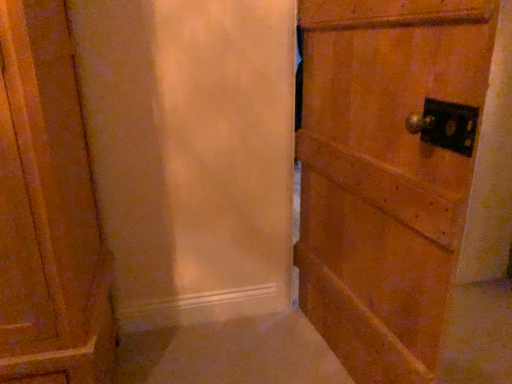
The height and width of the screenshot is (384, 512). What are the coordinates of `wooden door at center` in the screenshot? It's located at click(408, 187).

What do you see at coordinates (408, 187) in the screenshot? I see `wooden door at center` at bounding box center [408, 187].

You are a GUI agent. You are given a task and a screenshot of the screen. Output one action in this format:
    pyautogui.click(x=<x>, y=<y>)
    Task: Click on the wooden door at center
    
    Given the screenshot: What is the action you would take?
    pyautogui.click(x=408, y=187)